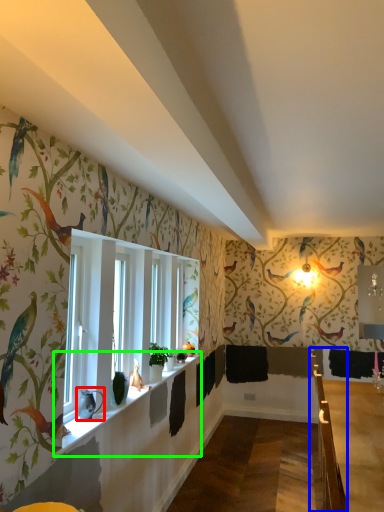
Question: Estimate the real-world distances between objects in this image. Which object is closer to animal (highlighted by a red box), rail (highlighted by a blue box) or window sill (highlighted by a green box)?

Choices:
 (A) rail
 (B) window sill

Answer: (B)